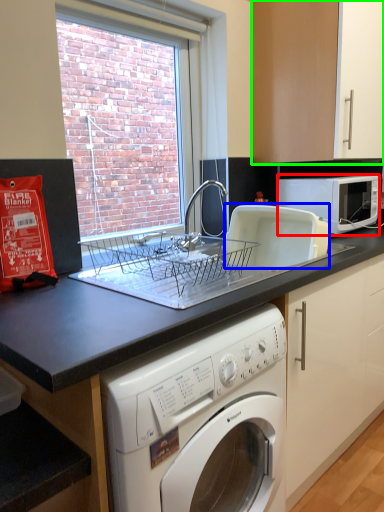
Question: Considering the real-world distances, which object is closest to microwave oven (highlighted by a red box)? appliance (highlighted by a blue box) or cabinetry (highlighted by a green box).

Choices:
 (A) appliance
 (B) cabinetry

Answer: (A)